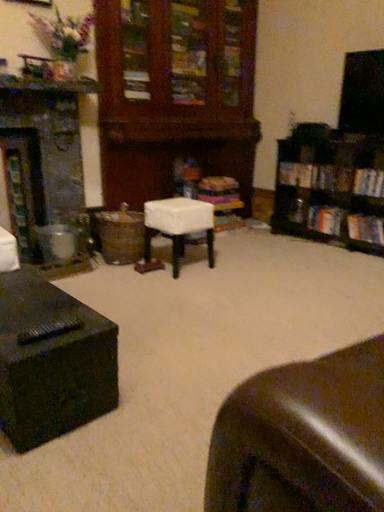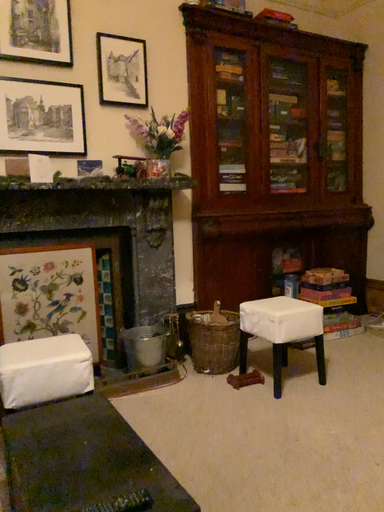
Question: Which way did the camera rotate in the video?

Choices:
 (A) rotated left
 (B) rotated right

Answer: (A)